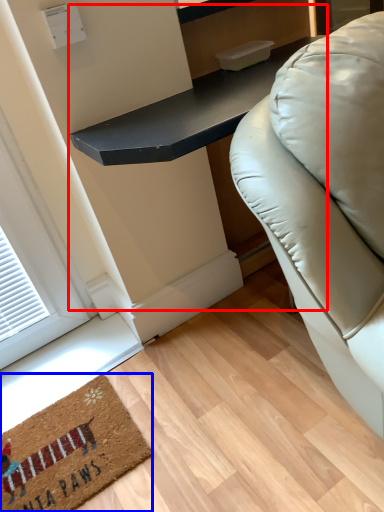
Question: Which object is closer to the camera taking this photo, table (highlighted by a red box) or mat (highlighted by a blue box)?

Choices:
 (A) table
 (B) mat

Answer: (A)